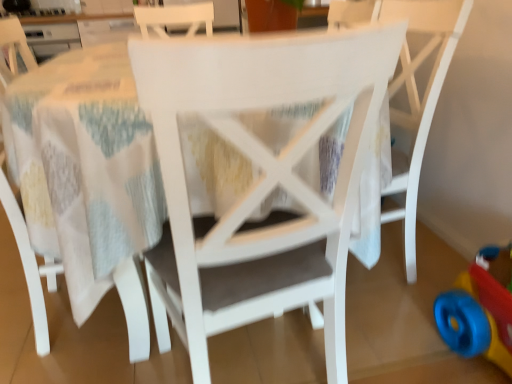
Where is `white matte chair at center, which is the second chair from left to right`? The width and height of the screenshot is (512, 384). white matte chair at center, which is the second chair from left to right is located at coordinates (261, 176).

The height and width of the screenshot is (384, 512). What are the coordinates of `rubberized plastic toy at lower right` in the screenshot? It's located at (480, 309).

Looking at this image, can you tell me how much rubberized plastic toy at lower right and white matte chair at center, which is the second chair from left to right, differ in facing direction?

They differ by 86.6 degrees in their facing directions.

In terms of width, does rubberized plastic toy at lower right look wider or thinner when compared to white matte chair at center, which is the 2th chair in right-to-left order?

Considering their sizes, rubberized plastic toy at lower right looks slimmer than white matte chair at center, which is the 2th chair in right-to-left order.

Is rubberized plastic toy at lower right facing away from white matte chair at center, which is the 2th chair in right-to-left order?

rubberized plastic toy at lower right does not have its back to white matte chair at center, which is the 2th chair in right-to-left order.

Find the location of a particular element. This screenshot has width=512, height=384. the 1st chair above when counting from the rubberized plastic toy at lower right (from the image's perspective) is located at coordinates (261, 176).

Which object is positioned more to the left, white matte chair at center, the 1th chair positioned from the right, or white matte chair at center, which is the 1th chair in left-to-right order?

white matte chair at center, which is the 1th chair in left-to-right order, is more to the left.

Is white matte chair at center, the 1th chair positioned from the right, outside of white matte chair at center, which ranks as the third chair in right-to-left order?

Indeed, white matte chair at center, the 1th chair positioned from the right, is completely outside white matte chair at center, which ranks as the third chair in right-to-left order.

In order to click on chair above the white matte chair at center, which ranks as the third chair in right-to-left order (from a real-world perspective) in this screenshot , I will do `click(411, 89)`.

Between white matte chair at center, the 1th chair positioned from the right, and white matte chair at center, which ranks as the third chair in right-to-left order, which one has more height?

With more height is white matte chair at center, the 1th chair positioned from the right.

Looking at their sizes, would you say white matte chair at center, which is the third chair in left-to-right order, is wider or thinner than white matte chair at center, which is the 2th chair in right-to-left order?

In the image, white matte chair at center, which is the third chair in left-to-right order, appears to be more narrow than white matte chair at center, which is the 2th chair in right-to-left order.

In the scene shown: From a real-world perspective, which is physically below, white matte chair at center, which is the third chair in left-to-right order, or white matte chair at center, which is the second chair from left to right?

In real-world perspective, white matte chair at center, which is the second chair from left to right, is lower.

Looking at this image, in terms of height, does white matte chair at center, which is the third chair in left-to-right order, look taller or shorter compared to white matte chair at center, which is the second chair from left to right?

white matte chair at center, which is the third chair in left-to-right order, is taller than white matte chair at center, which is the second chair from left to right.

Is white matte chair at center, which ranks as the third chair in right-to-left order, to the right of white matte chair at center, which is the 2th chair in right-to-left order, from the viewer's perspective?

In fact, white matte chair at center, which ranks as the third chair in right-to-left order, is to the left of white matte chair at center, which is the 2th chair in right-to-left order.

Which object is further away from the camera, white matte chair at center, which is the 1th chair in left-to-right order, or white matte chair at center, which is the second chair from left to right?

Positioned behind is white matte chair at center, which is the 1th chair in left-to-right order.

From the image's perspective, is white matte chair at center, which is the 1th chair in left-to-right order, located above or below white matte chair at center, which is the 2th chair in right-to-left order?

Clearly, from the image's perspective, white matte chair at center, which is the 1th chair in left-to-right order, is above white matte chair at center, which is the 2th chair in right-to-left order.

Which is correct: white matte chair at center, which is the 1th chair in left-to-right order, is inside white matte chair at center, which is the second chair from left to right, or outside of it?

white matte chair at center, which is the 1th chair in left-to-right order, lies outside white matte chair at center, which is the second chair from left to right.

In terms of size, does white matte chair at center, which is the second chair from left to right, appear bigger or smaller than white matte chair at center, which is the 1th chair in left-to-right order?

Clearly, white matte chair at center, which is the second chair from left to right, is larger in size than white matte chair at center, which is the 1th chair in left-to-right order.

Based on the photo, is white matte chair at center, which ranks as the third chair in right-to-left order, at the back of white matte chair at center, which is the 2th chair in right-to-left order?

No, white matte chair at center, which ranks as the third chair in right-to-left order, is not at the back of white matte chair at center, which is the 2th chair in right-to-left order.

How distant is white matte chair at center, which is the 2th chair in right-to-left order, from white matte chair at center, which is the 1th chair in left-to-right order?

white matte chair at center, which is the 2th chair in right-to-left order, and white matte chair at center, which is the 1th chair in left-to-right order, are 17.58 inches apart.

From the image's perspective, is white matte chair at center, which is the second chair from left to right, above or below white matte chair at center, which ranks as the third chair in right-to-left order?

From the image's perspective, white matte chair at center, which is the second chair from left to right, appears below white matte chair at center, which ranks as the third chair in right-to-left order.

Between rubberized plastic toy at lower right and white matte chair at center, which is the third chair in left-to-right order, which one has smaller size?

Smaller between the two is rubberized plastic toy at lower right.

From a real-world perspective, is rubberized plastic toy at lower right on white matte chair at center, the 1th chair positioned from the right?

No, from a real-world perspective, rubberized plastic toy at lower right is not on top of white matte chair at center, the 1th chair positioned from the right.

From the image's perspective, which is above, rubberized plastic toy at lower right or white matte chair at center, the 1th chair positioned from the right?

white matte chair at center, the 1th chair positioned from the right, appears higher in the image.

Can you confirm if white matte chair at center, which is the second chair from left to right, is shorter than white matte chair at center, the 1th chair positioned from the right?

Indeed, white matte chair at center, which is the second chair from left to right, has a lesser height compared to white matte chair at center, the 1th chair positioned from the right.

Is white matte chair at center, which is the second chair from left to right, facing away from white matte chair at center, which is the third chair in left-to-right order?

No, white matte chair at center, which is the second chair from left to right,'s orientation is not away from white matte chair at center, which is the third chair in left-to-right order.

In the image, is white matte chair at center, which is the 2th chair in right-to-left order, positioned in front of or behind white matte chair at center, the 1th chair positioned from the right?

In the image, white matte chair at center, which is the 2th chair in right-to-left order, appears in front of white matte chair at center, the 1th chair positioned from the right.

Is white matte chair at center, which is the second chair from left to right, at the left side of white matte chair at center, the 1th chair positioned from the right?

Yes, white matte chair at center, which is the second chair from left to right, is to the left of white matte chair at center, the 1th chair positioned from the right.

Identify the location of toy to the right of white matte chair at center, which is the 2th chair in right-to-left order. Image resolution: width=512 pixels, height=384 pixels. (480, 309).

Find the location of a particular element. Image resolution: width=512 pixels, height=384 pixels. chair that is behind the white matte chair at center, which ranks as the third chair in right-to-left order is located at coordinates (411, 89).

When comparing their distances from white matte chair at center, which is the 1th chair in left-to-right order, does white matte chair at center, which is the third chair in left-to-right order, or white matte chair at center, which is the second chair from left to right, seem further?

white matte chair at center, which is the third chair in left-to-right order, lies further to white matte chair at center, which is the 1th chair in left-to-right order, than the other object.

Estimate the real-world distances between objects in this image. Which object is further from rubberized plastic toy at lower right, white matte chair at center, which ranks as the third chair in right-to-left order, or white matte chair at center, which is the third chair in left-to-right order?

The object further to rubberized plastic toy at lower right is white matte chair at center, which ranks as the third chair in right-to-left order.

In the scene shown: When comparing their distances from white matte chair at center, which is the second chair from left to right, does white matte chair at center, which ranks as the third chair in right-to-left order, or white matte chair at center, the 1th chair positioned from the right, seem closer?

→ Based on the image, white matte chair at center, which ranks as the third chair in right-to-left order, appears to be nearer to white matte chair at center, which is the second chair from left to right.

Looking at the image, which one is located further to white matte chair at center, which ranks as the third chair in right-to-left order, white matte chair at center, which is the 2th chair in right-to-left order, or white matte chair at center, the 1th chair positioned from the right?

white matte chair at center, the 1th chair positioned from the right, lies further to white matte chair at center, which ranks as the third chair in right-to-left order, than the other object.

From the image, which object appears to be nearer to rubberized plastic toy at lower right, white matte chair at center, which is the second chair from left to right, or white matte chair at center, which is the 1th chair in left-to-right order?

white matte chair at center, which is the second chair from left to right, is positioned closer to the anchor rubberized plastic toy at lower right.

Estimate the real-world distances between objects in this image. Which object is closer to white matte chair at center, the 1th chair positioned from the right, rubberized plastic toy at lower right or white matte chair at center, which is the 2th chair in right-to-left order?

rubberized plastic toy at lower right lies closer to white matte chair at center, the 1th chair positioned from the right, than the other object.

From the image, which object appears to be farther from rubberized plastic toy at lower right, white matte chair at center, which is the third chair in left-to-right order, or white matte chair at center, which is the 1th chair in left-to-right order?

white matte chair at center, which is the 1th chair in left-to-right order, is further to rubberized plastic toy at lower right.

Based on their spatial positions, is rubberized plastic toy at lower right or white matte chair at center, the 1th chair positioned from the right, further from white matte chair at center, which is the second chair from left to right?

white matte chair at center, the 1th chair positioned from the right.

In order to click on chair between white matte chair at center, which is the second chair from left to right, and rubberized plastic toy at lower right in this screenshot , I will do `click(411, 89)`.

Identify the location of chair situated between white matte chair at center, which is the 1th chair in left-to-right order, and white matte chair at center, which is the third chair in left-to-right order, from left to right. Image resolution: width=512 pixels, height=384 pixels. (261, 176).